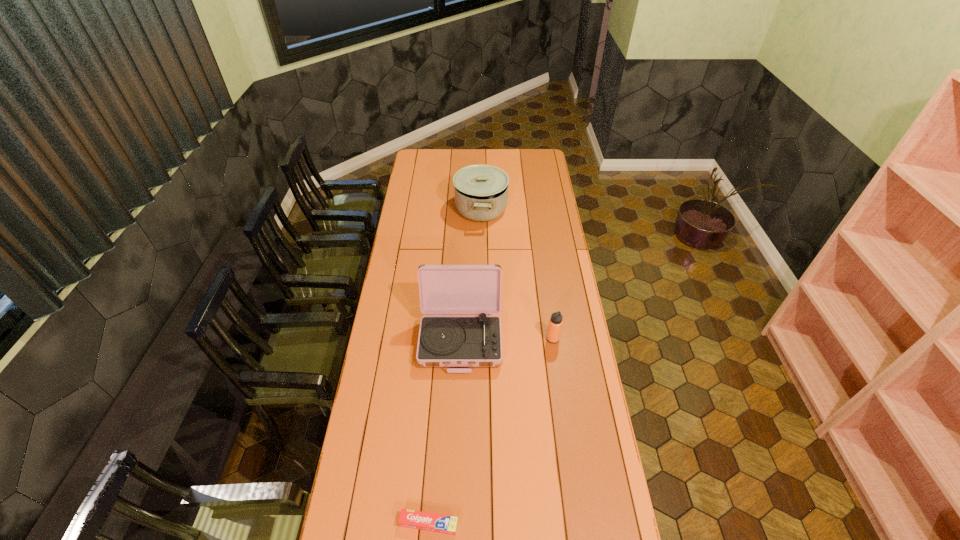
At what (x,y) coordinates should I click in order to perform the action: click on record player. Please return your answer as a coordinate pair (x, y). The height and width of the screenshot is (540, 960). Looking at the image, I should click on (446, 341).

The height and width of the screenshot is (540, 960). What are the coordinates of `saucepan` in the screenshot? It's located at click(481, 191).

This screenshot has width=960, height=540. Identify the location of the farthest object. (481, 191).

Find the location of a particular element. The width and height of the screenshot is (960, 540). thermos bottle is located at coordinates (555, 323).

Find the location of a particular element. This screenshot has height=540, width=960. the second shortest object is located at coordinates (555, 323).

This screenshot has width=960, height=540. I want to click on the nearest object, so click(414, 519).

At what (x,y) coordinates should I click in order to perform the action: click on the shortest object. Please return your answer as a coordinate pair (x, y). Looking at the image, I should click on (414, 519).

The image size is (960, 540). I want to click on free space located with the lid open on the tallest object, so click(x=457, y=443).

The width and height of the screenshot is (960, 540). Find the location of `free region located on the right of the farthest object`. free region located on the right of the farthest object is located at coordinates (522, 208).

Locate an element on the screen. The height and width of the screenshot is (540, 960). vacant space situated on the right of the third tallest object is located at coordinates (584, 339).